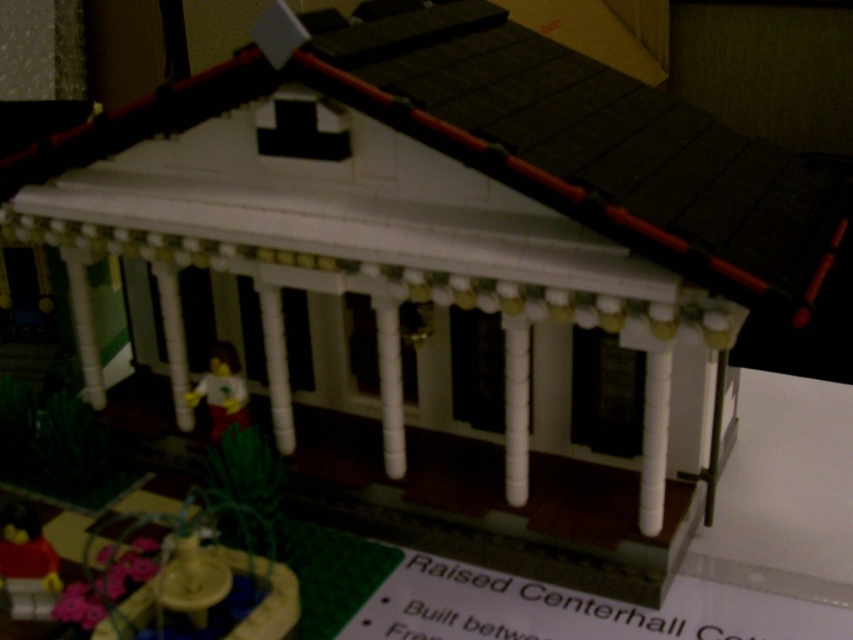
At what (x,y) coordinates should I click in order to perform the action: click on smooth yellow fountain at lower left. Please return your answer as a coordinate pair (x, y). Looking at the image, I should click on [x=265, y=596].

Is point (142, 497) positioned behind point (227, 394)?

That is True.

You are a GUI agent. You are given a task and a screenshot of the screen. Output one action in this format:
    pyautogui.click(x=<x>, y=<y>)
    Task: Click on the smooth yellow fountain at lower left
    
    Given the screenshot: What is the action you would take?
    pyautogui.click(x=265, y=596)

Find the location of a particular element. The image size is (853, 640). smooth yellow fountain at lower left is located at coordinates (265, 596).

Between point (241, 557) and point (24, 584), which one is positioned behind?

Point (24, 584)

Does smooth yellow fountain at lower left have a lesser width compared to red plastic figure at lower left?

No.

The height and width of the screenshot is (640, 853). I want to click on smooth yellow fountain at lower left, so click(x=265, y=596).

The height and width of the screenshot is (640, 853). Identify the location of smooth yellow fountain at lower left. (265, 596).

The image size is (853, 640). What do you see at coordinates (26, 564) in the screenshot? I see `red plastic figure at lower left` at bounding box center [26, 564].

You are a GUI agent. You are given a task and a screenshot of the screen. Output one action in this format:
    pyautogui.click(x=<x>, y=<y>)
    Task: Click on the red plastic figure at lower left
    
    Given the screenshot: What is the action you would take?
    click(x=26, y=564)